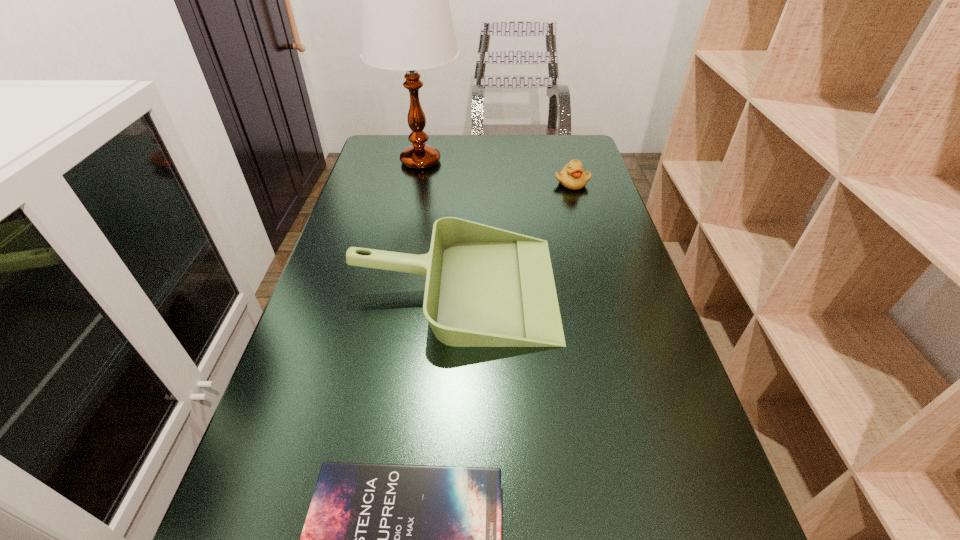
Identify the location of the tallest object. (406, 24).

I want to click on the third farthest object, so click(485, 287).

Find the location of a particular element. the second tallest object is located at coordinates (485, 287).

Locate an element on the screen. This screenshot has height=540, width=960. the rightmost object is located at coordinates (572, 176).

Locate an element on the screen. the second shortest object is located at coordinates (572, 176).

Identify the location of free region located on the front of the table lamp. Image resolution: width=960 pixels, height=540 pixels. pos(405,237).

Where is `vacant point located on the scoop of the second tallest object`? vacant point located on the scoop of the second tallest object is located at coordinates (598, 287).

The image size is (960, 540). What are the coordinates of `vacant area situated 0.070m at the beak of the duckling` in the screenshot? It's located at (578, 205).

Where is `object present at the far edge`? This screenshot has height=540, width=960. object present at the far edge is located at coordinates (406, 24).

Locate an element on the screen. This screenshot has height=540, width=960. table lamp situated at the left edge is located at coordinates (406, 24).